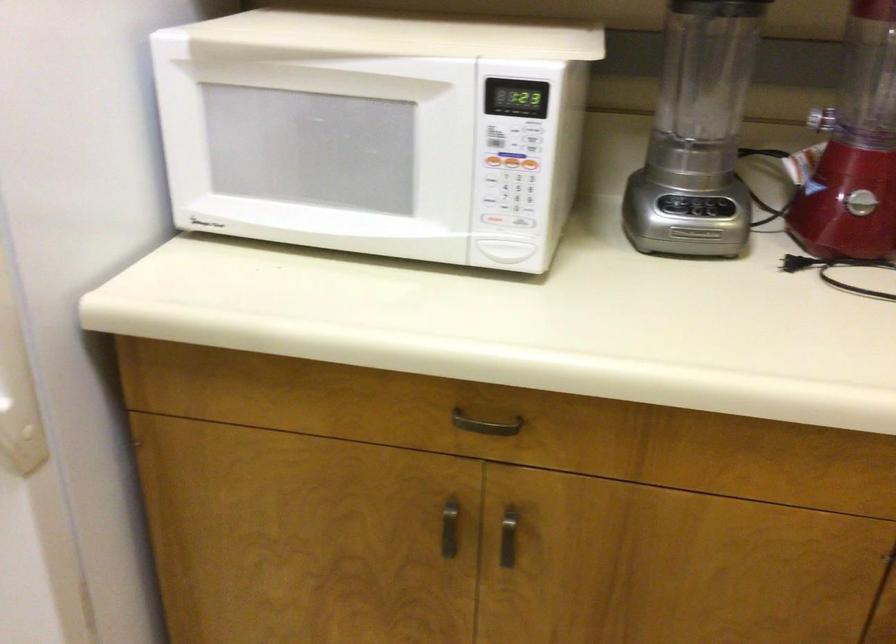
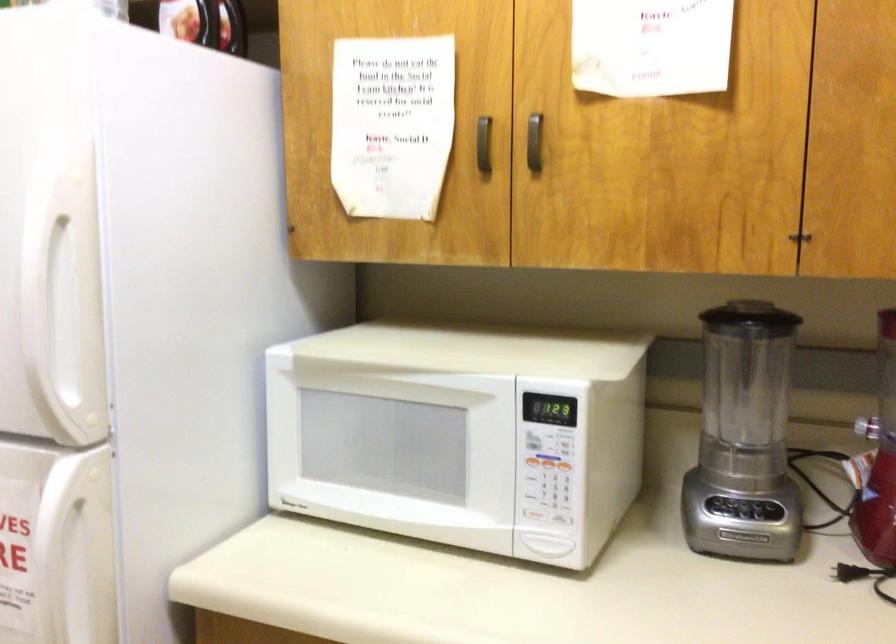
In the second image, find the point that corresponds to [695,232] in the first image.

(743, 536)